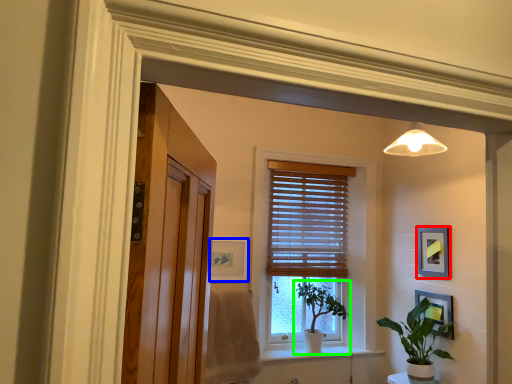
Question: Considering the real-world distances, which object is closest to picture frame (highlighted by a red box)? picture frame (highlighted by a blue box) or houseplant (highlighted by a green box).

Choices:
 (A) picture frame
 (B) houseplant

Answer: (B)